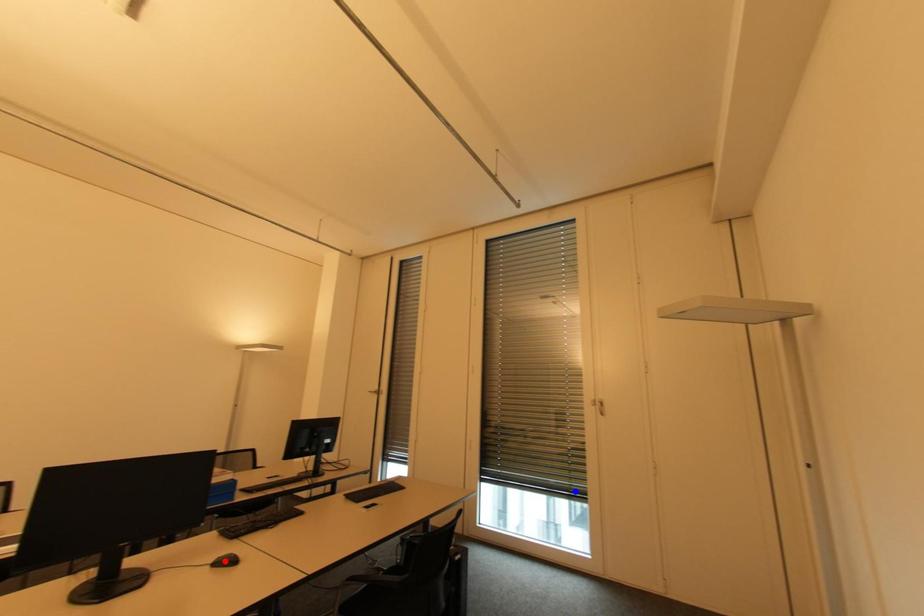
Question: Which of the two points in the image is closer to the camera?

Choices:
 (A) Blue point is closer.
 (B) Red point is closer.

Answer: (B)